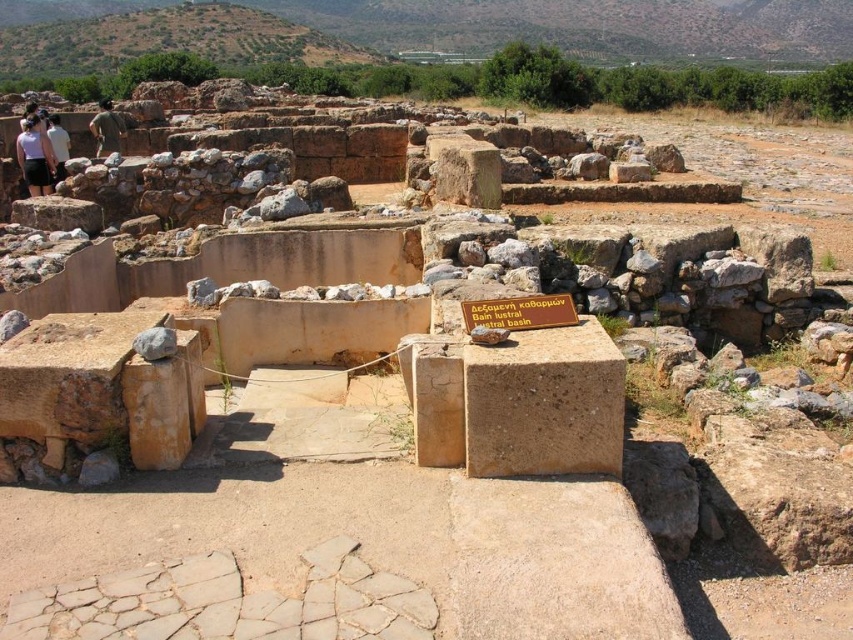
Who is shorter, green fabric shirt at upper left or white cotton shirt at upper left?

With less height is white cotton shirt at upper left.

Is point (115, 131) closer to viewer compared to point (48, 120)?

No, (115, 131) is behind (48, 120).

Between point (97, 116) and point (67, 144), which one is positioned behind?

Point (97, 116)

The height and width of the screenshot is (640, 853). What are the coordinates of `green fabric shirt at upper left` in the screenshot? It's located at (106, 129).

Does brown stone sign at center have a smaller size compared to matte white shirt at left?

Yes, brown stone sign at center is smaller than matte white shirt at left.

Is brown stone sign at center shorter than matte white shirt at left?

Yes, brown stone sign at center is shorter than matte white shirt at left.

Between point (496, 305) and point (30, 163), which one is positioned behind?

The point (30, 163) is behind.

You are a GUI agent. You are given a task and a screenshot of the screen. Output one action in this format:
    pyautogui.click(x=<x>, y=<y>)
    Task: Click on the brown stone sign at center
    This screenshot has height=640, width=853.
    Given the screenshot: What is the action you would take?
    pyautogui.click(x=520, y=312)

Can you confirm if brown stone sign at center is wider than white cotton shirt at upper left?

In fact, brown stone sign at center might be narrower than white cotton shirt at upper left.

Who is more forward, (524, 317) or (67, 152)?

Point (524, 317)

What do you see at coordinates (520, 312) in the screenshot?
I see `brown stone sign at center` at bounding box center [520, 312].

I want to click on brown stone sign at center, so click(x=520, y=312).